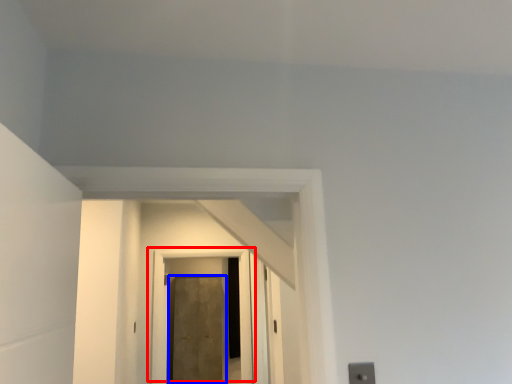
Question: Which object appears farthest to the camera in this image, door (highlighted by a red box) or door (highlighted by a blue box)?

Choices:
 (A) door
 (B) door

Answer: (B)